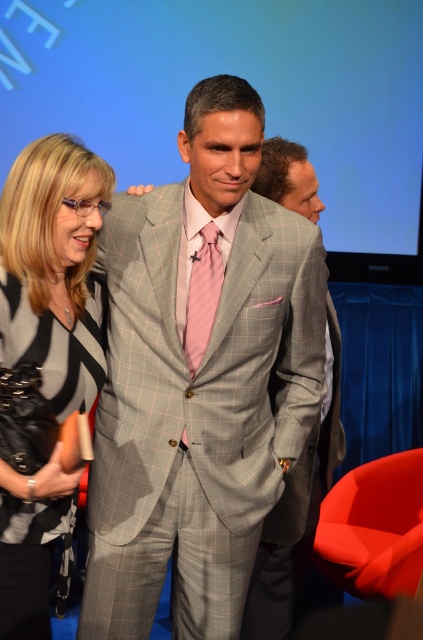
Does light gray checkered suit at center appear on the left side of black textured blazer at left?

No, light gray checkered suit at center is not to the left of black textured blazer at left.

Can you confirm if light gray checkered suit at center is bigger than black textured blazer at left?

Indeed, light gray checkered suit at center has a larger size compared to black textured blazer at left.

This screenshot has width=423, height=640. What do you see at coordinates (198, 381) in the screenshot? I see `light gray checkered suit at center` at bounding box center [198, 381].

Locate an element on the screen. light gray checkered suit at center is located at coordinates (198, 381).

Which of these two, light gray checkered suit at center or gray checkered suit at center, stands taller?

light gray checkered suit at center is taller.

Find the location of `light gray checkered suit at center`. light gray checkered suit at center is located at coordinates (198, 381).

Locate an element on the screen. light gray checkered suit at center is located at coordinates (198, 381).

Is light gray checkered suit at center in front of pink satin tie at center?

Yes, light gray checkered suit at center is closer to the viewer.

Between point (247, 204) and point (194, 253), which one is positioned in front?

Positioned in front is point (194, 253).

The width and height of the screenshot is (423, 640). Describe the element at coordinates (198, 381) in the screenshot. I see `light gray checkered suit at center` at that location.

You are a GUI agent. You are given a task and a screenshot of the screen. Output one action in this format:
    pyautogui.click(x=<x>, y=<y>)
    Task: Click on the light gray checkered suit at center
    This screenshot has height=640, width=423.
    Given the screenshot: What is the action you would take?
    pyautogui.click(x=198, y=381)